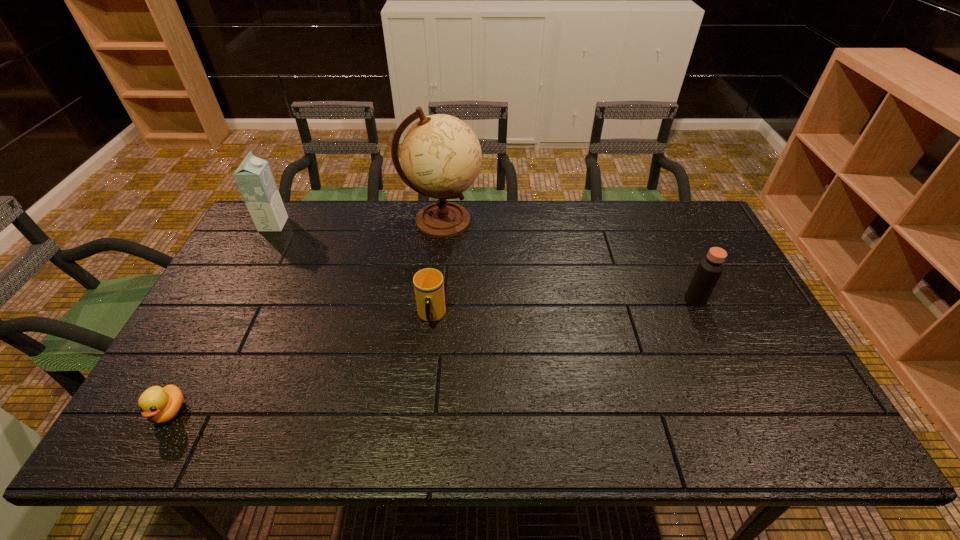
Where is `free location located on the side of the cup with the handle`? This screenshot has height=540, width=960. free location located on the side of the cup with the handle is located at coordinates (426, 371).

I want to click on globe that is at the far edge, so click(441, 157).

I want to click on carton that is at the far edge, so click(x=254, y=178).

Image resolution: width=960 pixels, height=540 pixels. I want to click on object located at the near edge, so click(159, 405).

Where is `carton located at the left edge`? carton located at the left edge is located at coordinates pyautogui.click(x=254, y=178).

The width and height of the screenshot is (960, 540). What are the coordinates of `duckling that is positioned at the left edge` in the screenshot? It's located at (159, 405).

I want to click on object present at the right edge, so click(710, 268).

Image resolution: width=960 pixels, height=540 pixels. I want to click on object present at the far left corner, so click(x=254, y=178).

Find the location of `object that is at the near left corner`. object that is at the near left corner is located at coordinates (159, 405).

In the image, there is a desktop. Identify the location of free region at the far edge. The width and height of the screenshot is (960, 540). (468, 232).